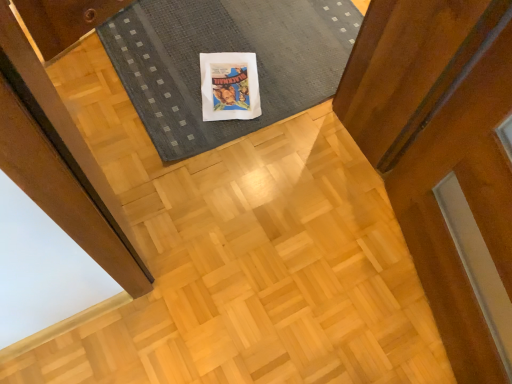
The image size is (512, 384). Describe the element at coordinates (229, 86) in the screenshot. I see `matte white comic book at center` at that location.

Where is `matte white comic book at center`? The image size is (512, 384). matte white comic book at center is located at coordinates (229, 86).

Where is `dark gray textured mat at center`? dark gray textured mat at center is located at coordinates (226, 51).

What do you see at coordinates (226, 51) in the screenshot? I see `dark gray textured mat at center` at bounding box center [226, 51].

Locate an element on the screen. matte white comic book at center is located at coordinates (229, 86).

From the picture: Considering the relative positions of matte white comic book at center and dark gray textured mat at center in the image provided, is matte white comic book at center to the left of dark gray textured mat at center from the viewer's perspective?

Yes, matte white comic book at center is to the left of dark gray textured mat at center.

Considering the relative positions of matte white comic book at center and dark gray textured mat at center in the image provided, is matte white comic book at center in front of dark gray textured mat at center?

No, the depth of matte white comic book at center is greater than that of dark gray textured mat at center.

Which point is more distant from viewer, (218,85) or (162,47)?

The point (162,47) is farther from the camera.

From the image's perspective, relative to dark gray textured mat at center, is matte white comic book at center above or below?

From the image's perspective, matte white comic book at center appears below dark gray textured mat at center.

Consider the image. From a real-world perspective, who is located lower, matte white comic book at center or dark gray textured mat at center?

matte white comic book at center, from a real-world perspective.

Which of these two, matte white comic book at center or dark gray textured mat at center, is thinner?

matte white comic book at center.

Considering the relative sizes of matte white comic book at center and dark gray textured mat at center in the image provided, is matte white comic book at center shorter than dark gray textured mat at center?

Correct, matte white comic book at center is not as tall as dark gray textured mat at center.

Can you confirm if matte white comic book at center is smaller than dark gray textured mat at center?

Yes.

Is matte white comic book at center situated inside dark gray textured mat at center or outside?

matte white comic book at center is inside dark gray textured mat at center.

Is matte white comic book at center with dark gray textured mat at center?

matte white comic book at center and dark gray textured mat at center are clearly separated.

Does matte white comic book at center turn towards dark gray textured mat at center?

Yes, matte white comic book at center is aimed at dark gray textured mat at center.

Can you tell me how much matte white comic book at center and dark gray textured mat at center differ in facing direction?

There is a 156-degree angle between the facing directions of matte white comic book at center and dark gray textured mat at center.

This screenshot has height=384, width=512. I want to click on mat above the matte white comic book at center (from the image's perspective), so click(x=226, y=51).

Can you confirm if dark gray textured mat at center is positioned to the left of matte white comic book at center?

No, dark gray textured mat at center is not to the left of matte white comic book at center.

Between dark gray textured mat at center and matte white comic book at center, which one is positioned in front?

dark gray textured mat at center is more forward.

Does point (217, 125) come closer to viewer compared to point (255, 112)?

Yes, it is in front of point (255, 112).

From the image's perspective, which object appears higher, dark gray textured mat at center or matte white comic book at center?

dark gray textured mat at center appears higher in the image.

From the picture: From a real-world perspective, is dark gray textured mat at center beneath matte white comic book at center?

Incorrect, from a real-world perspective, dark gray textured mat at center is higher than matte white comic book at center.

Which of these two, dark gray textured mat at center or matte white comic book at center, is wider?

dark gray textured mat at center.

Considering the relative sizes of dark gray textured mat at center and matte white comic book at center in the image provided, is dark gray textured mat at center shorter than matte white comic book at center?

Incorrect, the height of dark gray textured mat at center does not fall short of that of matte white comic book at center.

Considering the relative sizes of dark gray textured mat at center and matte white comic book at center in the image provided, is dark gray textured mat at center bigger than matte white comic book at center?

Yes, dark gray textured mat at center is bigger than matte white comic book at center.

Could matte white comic book at center be considered to be inside dark gray textured mat at center?

Indeed, matte white comic book at center is located within dark gray textured mat at center.

Is dark gray textured mat at center touching matte white comic book at center?

No, dark gray textured mat at center is not next to matte white comic book at center.

Consider the image. Is dark gray textured mat at center looking in the opposite direction of matte white comic book at center?

Yes, dark gray textured mat at center is facing away from matte white comic book at center.

Based on the photo, how different are the orientations of dark gray textured mat at center and matte white comic book at center in degrees?

156 degrees.

How distant is dark gray textured mat at center from matte white comic book at center?

dark gray textured mat at center and matte white comic book at center are 5.94 inches apart from each other.

Where is `comic book character on the left side of dark gray textured mat at center`? The image size is (512, 384). comic book character on the left side of dark gray textured mat at center is located at coordinates (229, 86).

Locate an element on the screen. The height and width of the screenshot is (384, 512). mat above the matte white comic book at center (from a real-world perspective) is located at coordinates (226, 51).

You are a GUI agent. You are given a task and a screenshot of the screen. Output one action in this format:
    pyautogui.click(x=<x>, y=<y>)
    Task: Click on the comic book character that appears behind the dark gray textured mat at center
    
    Given the screenshot: What is the action you would take?
    pyautogui.click(x=229, y=86)